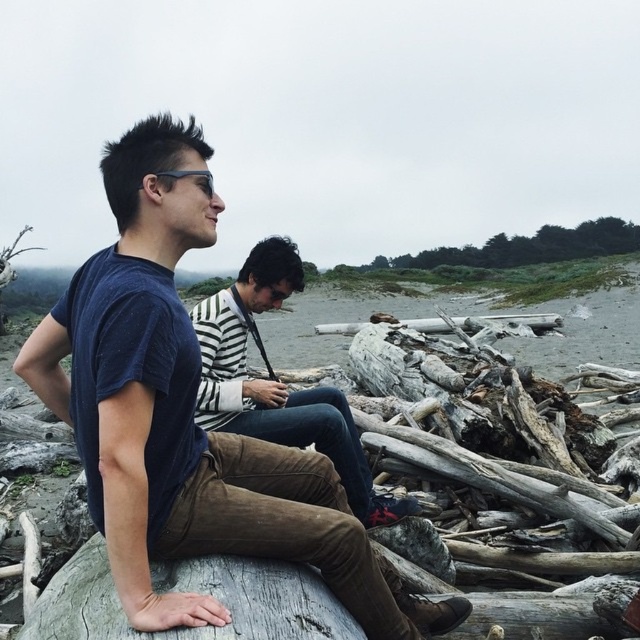
Between matte blue t-shirt at center and striped sweater at center, which one appears on the left side from the viewer's perspective?

Positioned to the left is matte blue t-shirt at center.

Which of these two, matte blue t-shirt at center or striped sweater at center, stands taller?

matte blue t-shirt at center

The width and height of the screenshot is (640, 640). What are the coordinates of `matte blue t-shirt at center` in the screenshot? It's located at (188, 417).